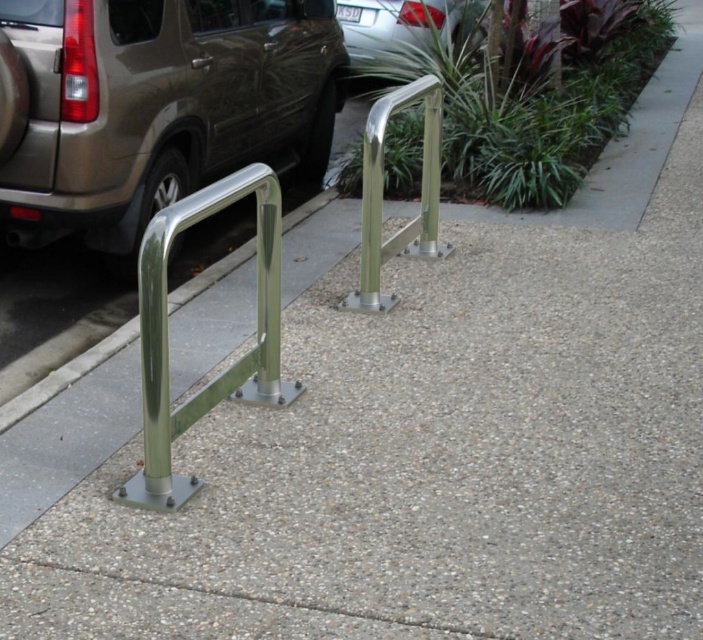
Question: Among these points, which one is nearest to the camera?

Choices:
 (A) (138, 280)
 (B) (423, 52)
 (C) (423, 179)

Answer: (A)

Question: Can you confirm if satin silver minivan at left is positioned to the left of polished stainless steel bike rack at center?

Choices:
 (A) yes
 (B) no

Answer: (A)

Question: Is polished stainless steel bike rack at center below silver metallic car at upper center?

Choices:
 (A) no
 (B) yes

Answer: (B)

Question: Considering the relative positions of satin silver minivan at left and silver metallic car at upper center in the image provided, where is satin silver minivan at left located with respect to silver metallic car at upper center?

Choices:
 (A) above
 (B) below

Answer: (B)

Question: Which point is closer to the camera?

Choices:
 (A) polished stainless steel handrail at center
 (B) silver metallic car at upper center
 (C) polished stainless steel bike rack at center
 (D) satin silver minivan at left

Answer: (C)

Question: Estimate the real-world distances between objects in this image. Which object is closer to the polished stainless steel bike rack at center?

Choices:
 (A) silver metallic car at upper center
 (B) satin silver minivan at left
 (C) polished stainless steel handrail at center

Answer: (C)